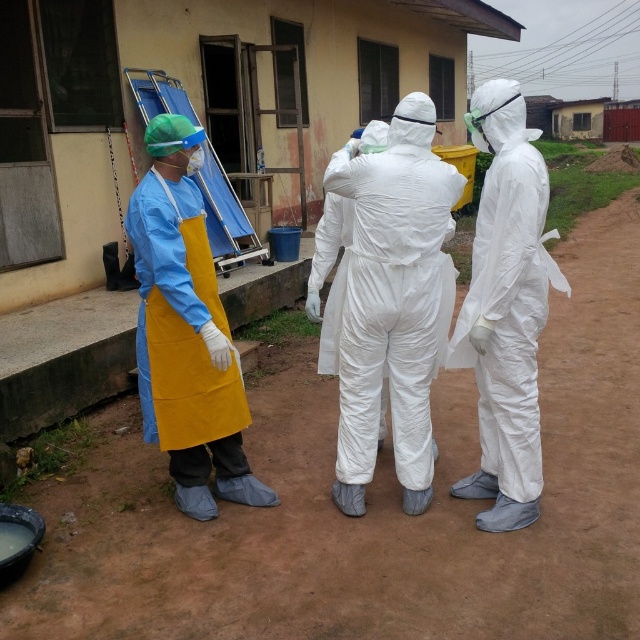
Is point (291, 483) positioned in front of point (218, 497)?

That is False.

Between brown dirt track at center and yellow matte apron at left, which one appears on the right side from the viewer's perspective?

From the viewer's perspective, yellow matte apron at left appears more on the right side.

Between point (154, 504) and point (182, 282), which one is positioned in front?

Positioned in front is point (182, 282).

This screenshot has width=640, height=640. What are the coordinates of `brown dirt track at center` in the screenshot? It's located at (371, 506).

Who is taller, yellow matte apron at left or white matte/soft suit at right?

With more height is yellow matte apron at left.

Who is positioned more to the right, yellow matte apron at left or white matte/soft suit at right?

Positioned to the right is white matte/soft suit at right.

From the picture: Who is more distant from viewer, (168, 316) or (525, 228)?

Point (168, 316)

Where is `yellow matte apron at left`? The height and width of the screenshot is (640, 640). yellow matte apron at left is located at coordinates pos(186,332).

Can you confirm if brown dirt track at center is positioned below white matte/soft robe at center?

Yes.

Who is higher up, brown dirt track at center or white matte/soft robe at center?

white matte/soft robe at center is above.

Between point (467, 380) and point (461, 192), which one is positioned behind?

Point (467, 380)

This screenshot has width=640, height=640. I want to click on brown dirt track at center, so click(x=371, y=506).